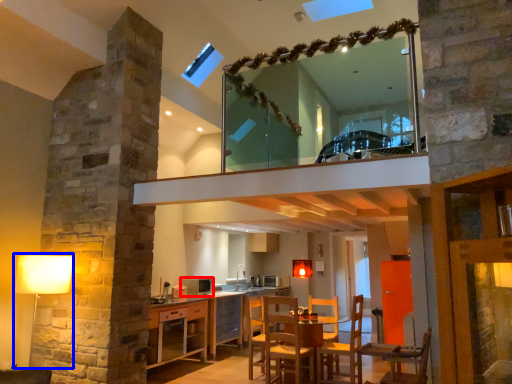
Question: Among these objects, which one is farthest to the camera, appliance (highlighted by a red box) or table lamp (highlighted by a blue box)?

Choices:
 (A) appliance
 (B) table lamp

Answer: (A)